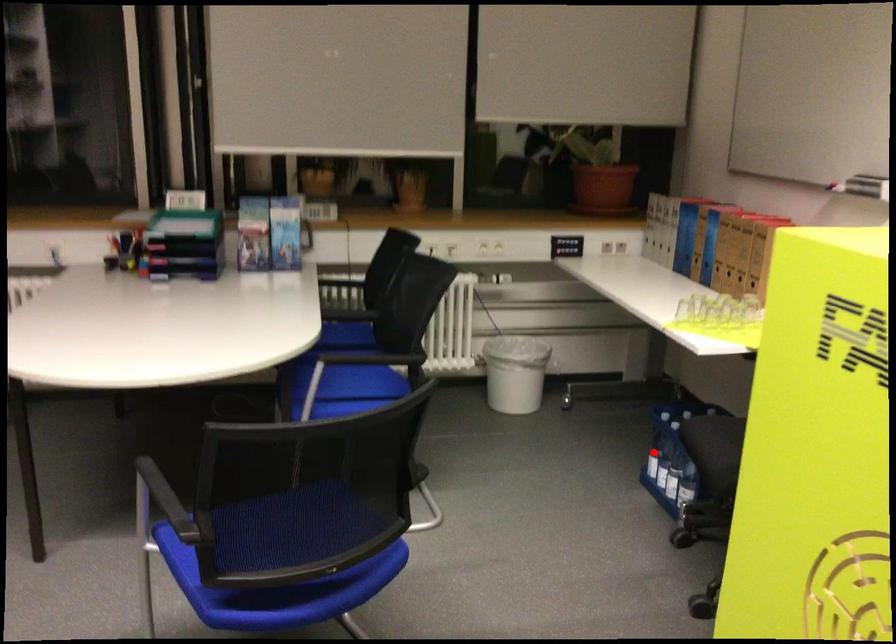
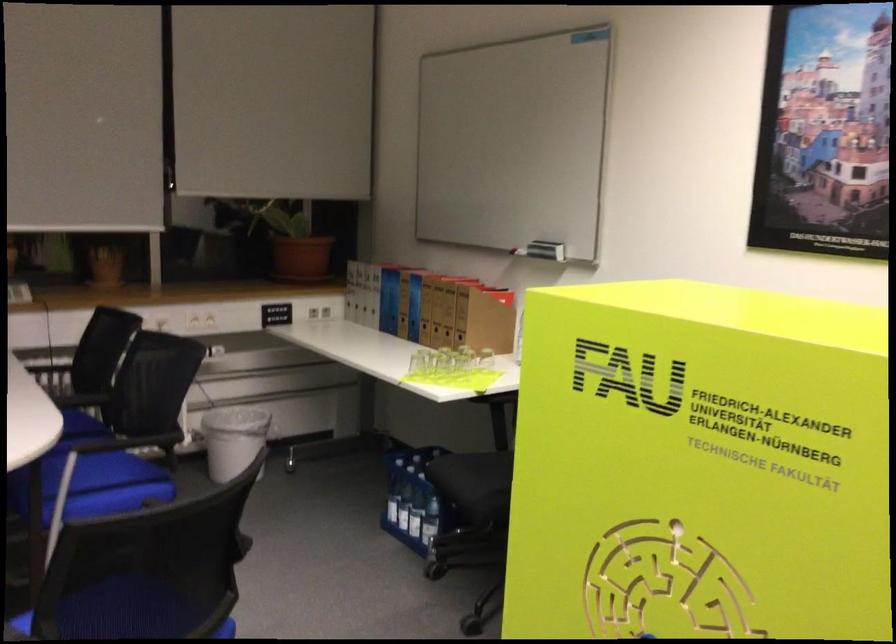
Where in the second image is the point corresponding to the highlighted location from the first image?

(392, 500)